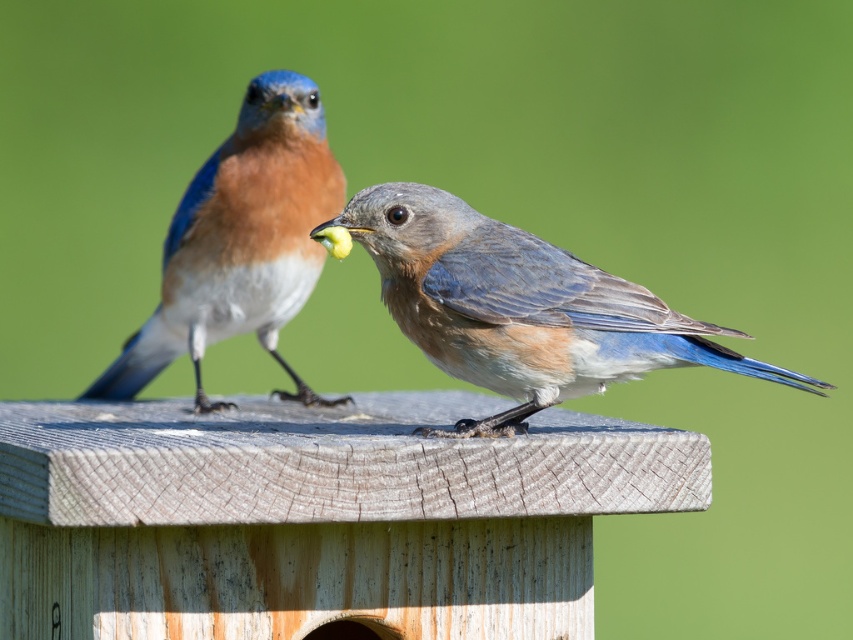
Which is above, blue-gray feathers at center or blue glossy bird at upper left?

blue glossy bird at upper left is higher up.

Which is behind, point (519, 417) or point (199, 196)?

Point (199, 196)

Which is in front, point (514, 378) or point (302, 100)?

Point (514, 378)

Identify the location of blue-gray feathers at center. (520, 307).